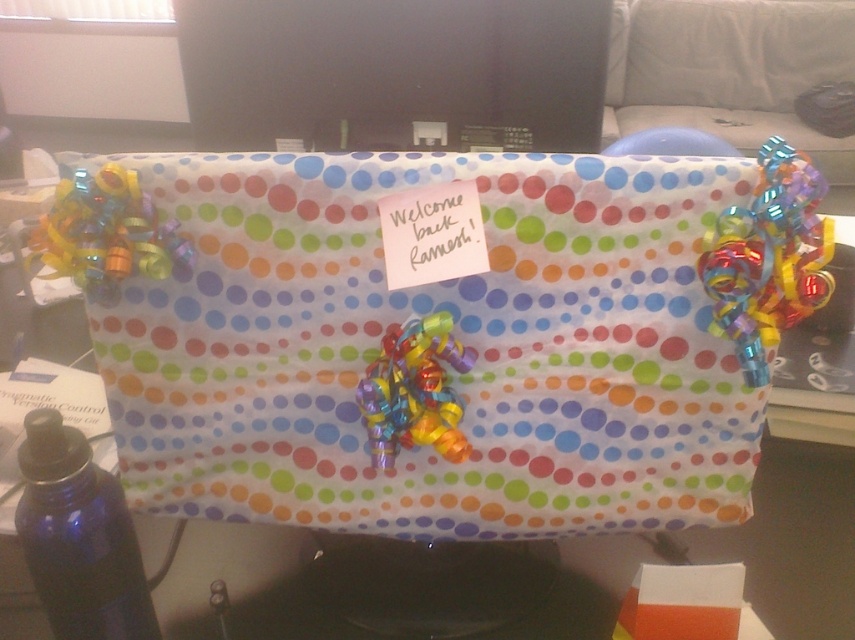
Question: Does polka dot wrapping paper at center appear under blue glass bottle at lower left?

Choices:
 (A) yes
 (B) no

Answer: (B)

Question: Which point is farther to the camera?

Choices:
 (A) blue glass bottle at lower left
 (B) polka dot wrapping paper at center

Answer: (B)

Question: Is polka dot wrapping paper at center to the right of blue glass bottle at lower left from the viewer's perspective?

Choices:
 (A) no
 (B) yes

Answer: (B)

Question: Does polka dot wrapping paper at center have a lesser width compared to blue glass bottle at lower left?

Choices:
 (A) no
 (B) yes

Answer: (A)